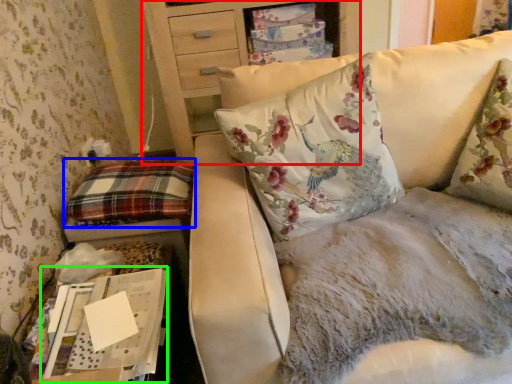
Question: Which is nearer to the furniture (highlighted by a red box)? pillow (highlighted by a blue box) or cardboard box (highlighted by a green box).

Choices:
 (A) pillow
 (B) cardboard box

Answer: (A)